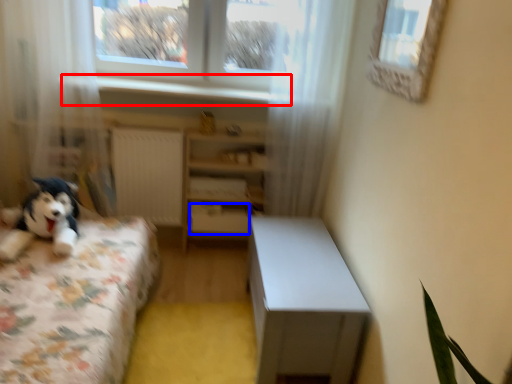
Question: Which object appears farthest to the camera in this image, window sill (highlighted by a red box) or drawer (highlighted by a blue box)?

Choices:
 (A) window sill
 (B) drawer

Answer: (B)